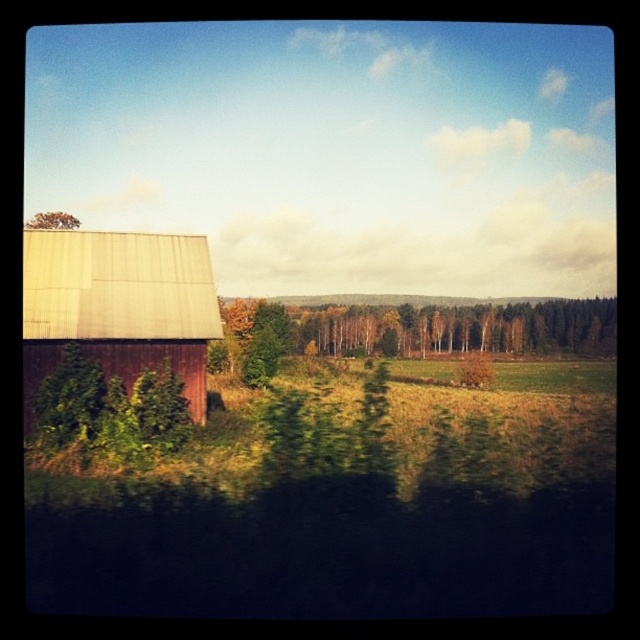
Based on the photo, does wooden barn at left have a smaller size compared to green leafy tree at center?

Correct, wooden barn at left occupies less space than green leafy tree at center.

Is wooden barn at left positioned behind green leafy tree at center?

No, wooden barn at left is in front of green leafy tree at center.

Looking at this image, who is more forward, [128,300] or [420,336]?

Point [128,300] is in front.

Image resolution: width=640 pixels, height=640 pixels. Identify the location of wooden barn at left. (118, 307).

What do you see at coordinates (451, 328) in the screenshot? Image resolution: width=640 pixels, height=640 pixels. I see `green leafy tree at center` at bounding box center [451, 328].

Does green leafy tree at center have a greater height compared to brown textured tree at upper left?

No, green leafy tree at center is not taller than brown textured tree at upper left.

The width and height of the screenshot is (640, 640). Identify the location of green leafy tree at center. (451, 328).

Is the position of wooden barn at left more distant than that of brown textured tree at upper left?

No, wooden barn at left is closer to the viewer.

Does wooden barn at left have a smaller size compared to brown textured tree at upper left?

Correct, wooden barn at left occupies less space than brown textured tree at upper left.

Which is in front, point (186, 339) or point (52, 228)?

Point (186, 339) is in front.

The image size is (640, 640). In order to click on wooden barn at left in this screenshot , I will do `click(118, 307)`.